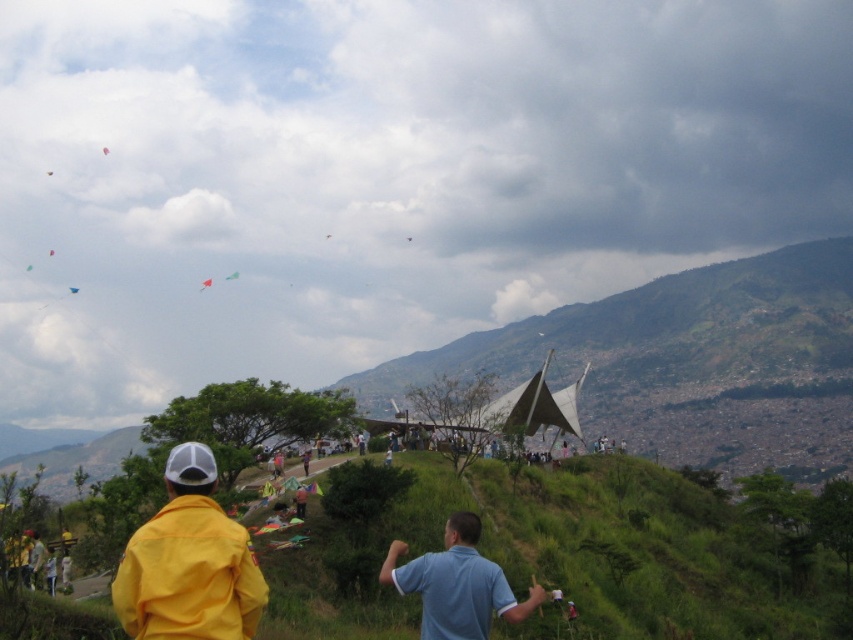
You are a photographer trying to capture the yellow matte jacket at lower left and the pink fabric kite at upper left in the same frame. Can you see both objects clearly without any obstruction?

The yellow matte jacket at lower left is in front of the pink fabric kite at upper left, so the jacket may partially block the view of the kite, making it difficult to capture both clearly in the same frame.